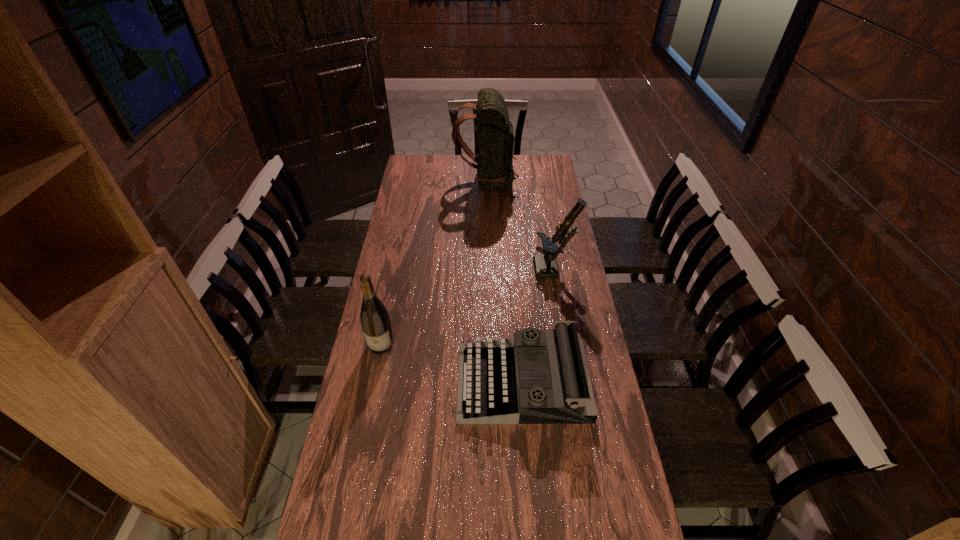
At what (x,y) coordinates should I click in order to perform the action: click on vacant position at the left edge of the desktop. Please return your answer as a coordinate pair (x, y). The height and width of the screenshot is (540, 960). Looking at the image, I should click on (379, 481).

Identify the location of free spot at the right edge of the desktop. The height and width of the screenshot is (540, 960). (570, 306).

The height and width of the screenshot is (540, 960). Find the location of `empty location between the leftmost object and the shortest object`. empty location between the leftmost object and the shortest object is located at coordinates (452, 363).

The image size is (960, 540). I want to click on vacant space in between the microscope and the wine bottle, so click(x=468, y=307).

Locate an element on the screen. vacant area that lies between the wine bottle and the farthest object is located at coordinates (x=434, y=262).

Locate an element on the screen. The height and width of the screenshot is (540, 960). empty space that is in between the microscope and the leftmost object is located at coordinates (468, 307).

I want to click on object that stands as the second closest to the shortest object, so click(x=545, y=264).

Point out which object is positioned as the nearest to the farthest object. Please provide its 2D coordinates. Your answer should be formatted as a tuple, i.e. [(x, y)], where the tuple contains the x and y coordinates of a point satisfying the conditions above.

[(545, 264)]

You are a GUI agent. You are given a task and a screenshot of the screen. Output one action in this format:
    pyautogui.click(x=<x>, y=<y>)
    Task: Click on the free space that satisfies the following two spatial constraints: 1. on the back of the farthest object; 2. on the label of the wine bottle
    This screenshot has width=960, height=540.
    Given the screenshot: What is the action you would take?
    pyautogui.click(x=489, y=344)

Where is `vacant space that satisfies the following two spatial constraints: 1. on the back of the tallest object; 2. on the label of the leftmost object`? This screenshot has height=540, width=960. vacant space that satisfies the following two spatial constraints: 1. on the back of the tallest object; 2. on the label of the leftmost object is located at coordinates (489, 344).